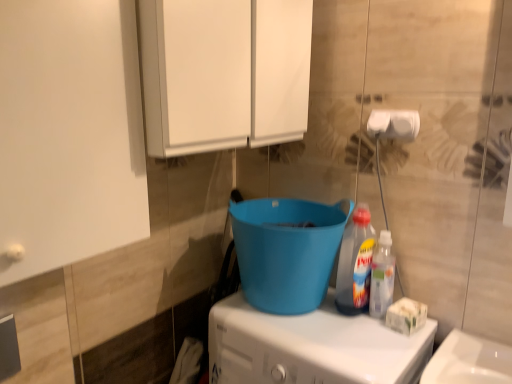
Question: Does translucent plastic bottle at center-right, the 2th bottle viewed from the right, have a smaller size compared to white plastic washing machine at lower center?

Choices:
 (A) no
 (B) yes

Answer: (B)

Question: From the image's perspective, does translucent plastic bottle at center-right, the 2th bottle viewed from the right, appear higher than white plastic washing machine at lower center?

Choices:
 (A) yes
 (B) no

Answer: (A)

Question: Is translucent plastic bottle at center-right, the 2th bottle viewed from the right, in front of white plastic washing machine at lower center?

Choices:
 (A) yes
 (B) no

Answer: (B)

Question: From a real-world perspective, is translucent plastic bottle at center-right, the 2th bottle viewed from the right, positioned under white plastic washing machine at lower center based on gravity?

Choices:
 (A) no
 (B) yes

Answer: (A)

Question: Is translucent plastic bottle at center-right, which ranks as the 1th bottle in left-to-right order, taller than white plastic washing machine at lower center?

Choices:
 (A) no
 (B) yes

Answer: (A)

Question: Considering the relative sizes of translucent plastic bottle at center-right, which ranks as the 1th bottle in left-to-right order, and white plastic washing machine at lower center in the image provided, is translucent plastic bottle at center-right, which ranks as the 1th bottle in left-to-right order, shorter than white plastic washing machine at lower center?

Choices:
 (A) no
 (B) yes

Answer: (B)

Question: Are white matte toilet paper at upper right and white matte cabinet at upper center located far from each other?

Choices:
 (A) no
 (B) yes

Answer: (A)

Question: From a real-world perspective, is white matte toilet paper at upper right positioned under white matte cabinet at upper center based on gravity?

Choices:
 (A) no
 (B) yes

Answer: (B)

Question: Is white matte cabinet at upper center inside white matte toilet paper at upper right?

Choices:
 (A) no
 (B) yes

Answer: (A)

Question: Is white matte toilet paper at upper right further to camera compared to white matte cabinet at upper center?

Choices:
 (A) yes
 (B) no

Answer: (A)

Question: Can you confirm if white matte toilet paper at upper right is shorter than white matte cabinet at upper center?

Choices:
 (A) no
 (B) yes

Answer: (B)

Question: Can we say white matte toilet paper at upper right lies outside white matte cabinet at upper center?

Choices:
 (A) yes
 (B) no

Answer: (A)

Question: Does white plastic washing machine at lower center have a lesser height compared to blue plastic bucket at center?

Choices:
 (A) yes
 (B) no

Answer: (B)